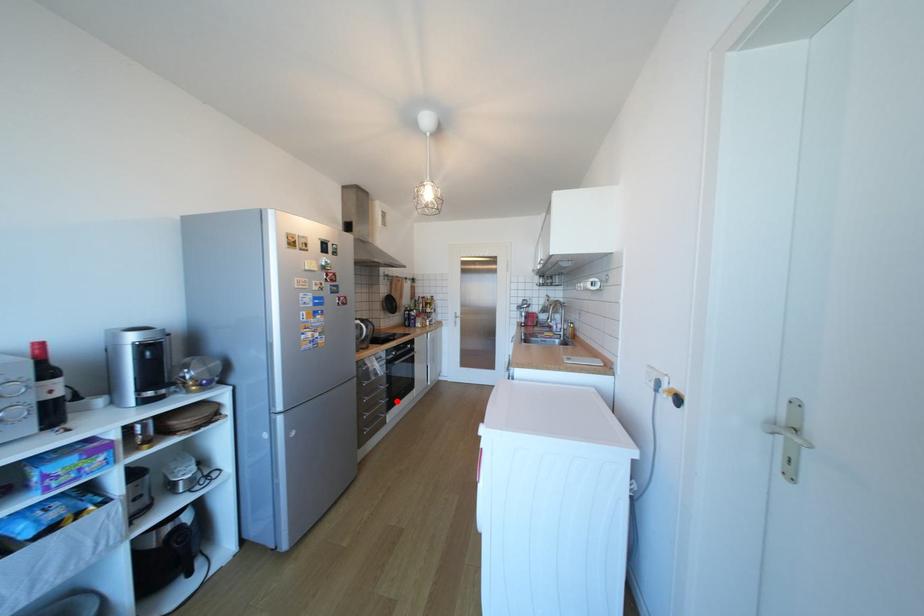
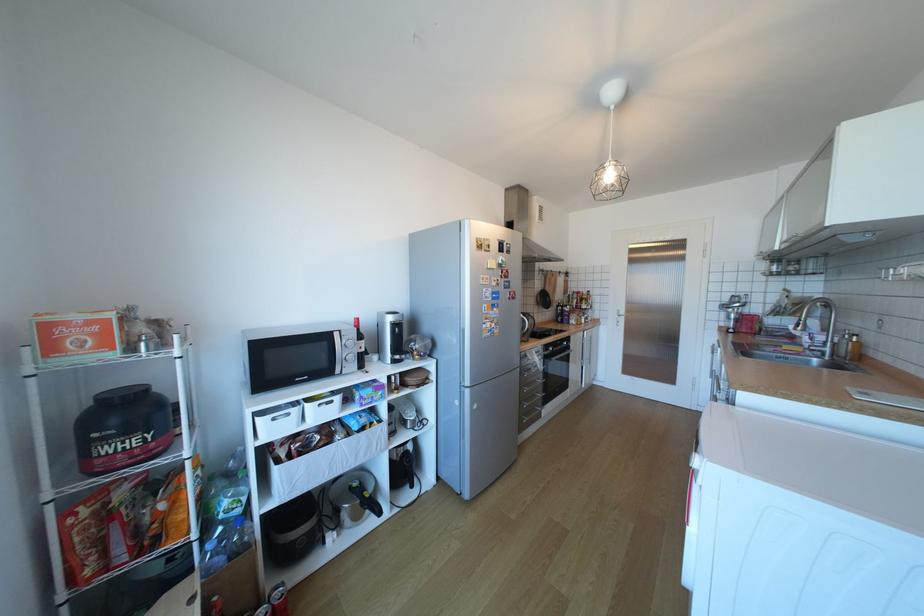
The point at the highlighted location is marked in the first image. Where is the corresponding point in the second image?

(553, 395)